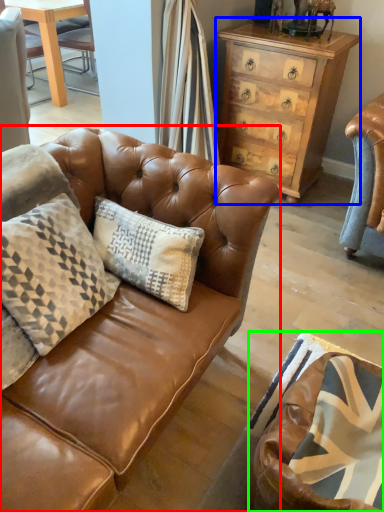
Question: Which is nearer to the studio couch (highlighted by a red box)? chest of drawers (highlighted by a blue box) or swivel chair (highlighted by a green box).

Choices:
 (A) chest of drawers
 (B) swivel chair

Answer: (B)